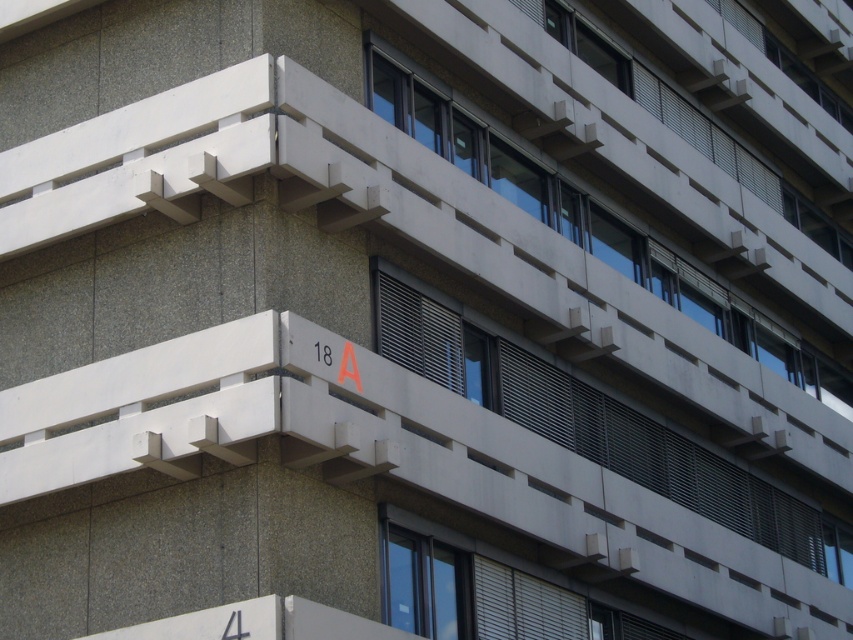
Question: Which point appears farthest from the camera in this image?

Choices:
 (A) (492, 362)
 (B) (643, 262)

Answer: (B)

Question: Which object is closer to the camera taking this photo?

Choices:
 (A) transparent glass window at upper center
 (B) white textured window at center

Answer: (B)

Question: Considering the relative positions of white textured window at center and transparent glass window at upper center in the image provided, where is white textured window at center located with respect to transparent glass window at upper center?

Choices:
 (A) below
 (B) above

Answer: (A)

Question: Can you confirm if white textured window at center is positioned below transparent glass window at upper center?

Choices:
 (A) no
 (B) yes

Answer: (B)

Question: Where is white textured window at center located in relation to transparent glass window at upper center in the image?

Choices:
 (A) right
 (B) left

Answer: (B)